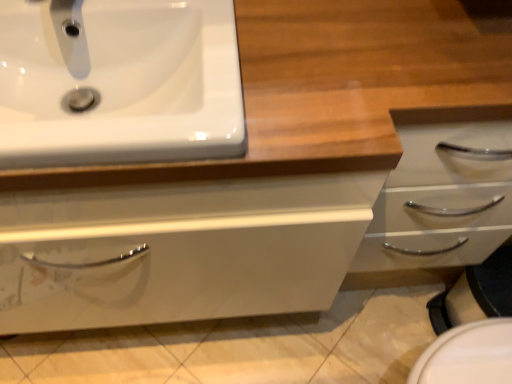
Question: Should I look upward or downward to see matte white faucet at upper left?

Choices:
 (A) up
 (B) down

Answer: (A)

Question: From the image's perspective, would you say matte white faucet at upper left is shown under white glossy sink at upper left?

Choices:
 (A) no
 (B) yes

Answer: (A)

Question: Does matte white faucet at upper left have a lesser height compared to white glossy sink at upper left?

Choices:
 (A) no
 (B) yes

Answer: (A)

Question: Is white glossy sink at upper left a part of matte white faucet at upper left?

Choices:
 (A) no
 (B) yes

Answer: (A)

Question: From a real-world perspective, does matte white faucet at upper left stand above white glossy sink at upper left?

Choices:
 (A) yes
 (B) no

Answer: (A)

Question: Does matte white faucet at upper left appear on the right side of white glossy sink at upper left?

Choices:
 (A) no
 (B) yes

Answer: (A)

Question: Is matte white faucet at upper left to the left of white glossy sink at upper left from the viewer's perspective?

Choices:
 (A) yes
 (B) no

Answer: (A)

Question: From the image's perspective, does white glossy sink at upper left appear higher than matte white faucet at upper left?

Choices:
 (A) yes
 (B) no

Answer: (B)

Question: From a real-world perspective, is white glossy sink at upper left on matte white faucet at upper left?

Choices:
 (A) yes
 (B) no

Answer: (B)

Question: Does white glossy sink at upper left appear on the right side of matte white faucet at upper left?

Choices:
 (A) yes
 (B) no

Answer: (A)

Question: Does white glossy sink at upper left lie in front of matte white faucet at upper left?

Choices:
 (A) yes
 (B) no

Answer: (A)

Question: Considering the relative sizes of white glossy sink at upper left and matte white faucet at upper left in the image provided, is white glossy sink at upper left thinner than matte white faucet at upper left?

Choices:
 (A) yes
 (B) no

Answer: (B)

Question: Considering the relative sizes of white glossy sink at upper left and matte white faucet at upper left in the image provided, is white glossy sink at upper left taller than matte white faucet at upper left?

Choices:
 (A) yes
 (B) no

Answer: (B)

Question: Considering the positions of point pos(210,96) and point pos(73,33), is point pos(210,96) closer or farther from the camera than point pos(73,33)?

Choices:
 (A) farther
 (B) closer

Answer: (B)